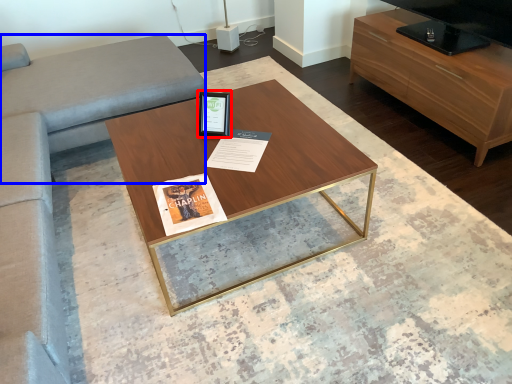
Question: Which object is closer to the camera taking this photo, picture frame (highlighted by a red box) or gray (highlighted by a blue box)?

Choices:
 (A) picture frame
 (B) gray

Answer: (B)